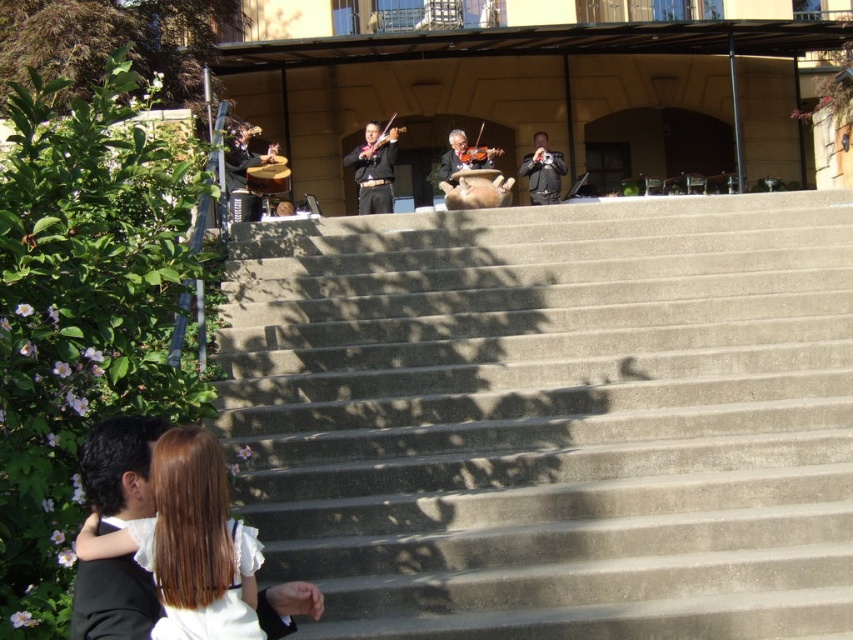
Based on the photo, between black satin suit at center and black leather jacket at upper center, which one appears on the right side from the viewer's perspective?

From the viewer's perspective, black leather jacket at upper center appears more on the right side.

Is point (373, 157) positioned in front of point (540, 144)?

That is True.

In order to click on black satin suit at center in this screenshot , I will do `click(374, 168)`.

The image size is (853, 640). Identify the location of black satin suit at center. (374, 168).

Is point (236, 204) more distant than point (479, 154)?

No, (236, 204) is in front of (479, 154).

Can you confirm if matte black drum at left is positioned above shiny brown violin at center?

Actually, matte black drum at left is below shiny brown violin at center.

Describe the element at coordinates (242, 170) in the screenshot. I see `matte black drum at left` at that location.

You are a GUI agent. You are given a task and a screenshot of the screen. Output one action in this format:
    pyautogui.click(x=<x>, y=<y>)
    Task: Click on the matte black drum at left
    The height and width of the screenshot is (640, 853).
    Given the screenshot: What is the action you would take?
    pyautogui.click(x=242, y=170)

Is concrete stairs at lower left closer to the viewer compared to matte black violin at center?

Yes, concrete stairs at lower left is in front of matte black violin at center.

Find the location of `concrete stairs at lower left`. concrete stairs at lower left is located at coordinates (550, 417).